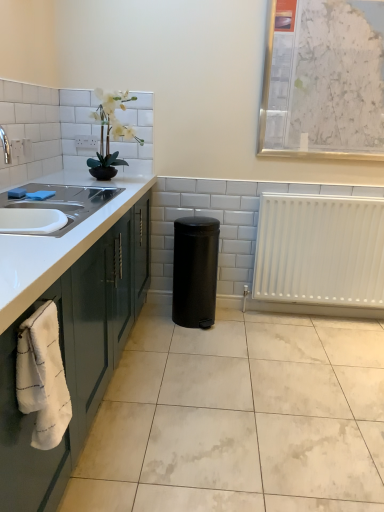
I want to click on free spot below white marble bulletin board at upper right (from a real-world perspective), so click(x=345, y=178).